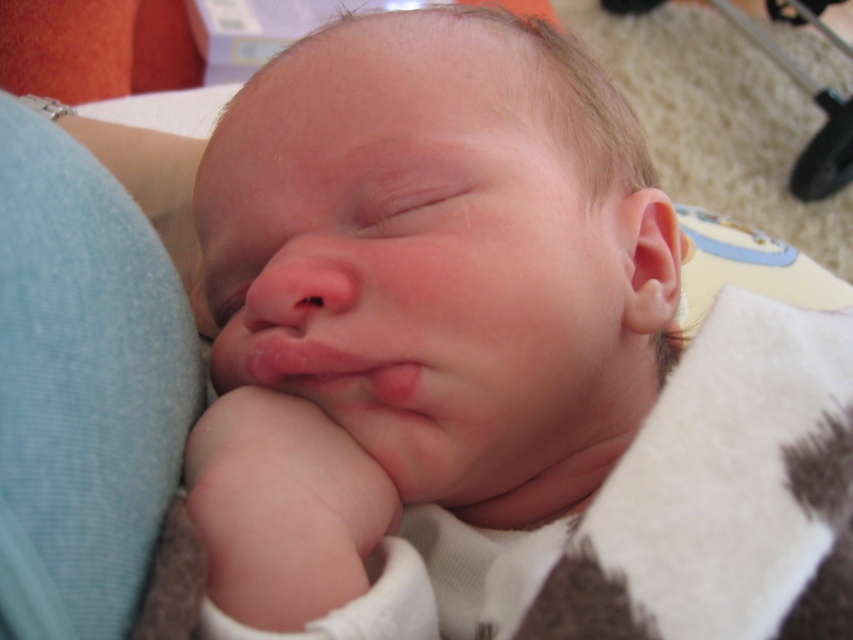
Question: Can you confirm if smooth skin newborn at center is positioned to the right of metallic silver stroller at upper right?

Choices:
 (A) yes
 (B) no

Answer: (B)

Question: Which object appears closest to the camera in this image?

Choices:
 (A) smooth skin newborn at center
 (B) metallic silver stroller at upper right

Answer: (A)

Question: From the image, what is the correct spatial relationship of smooth skin newborn at center in relation to metallic silver stroller at upper right?

Choices:
 (A) below
 (B) above

Answer: (A)

Question: Which point appears farthest from the camera in this image?

Choices:
 (A) (601, 472)
 (B) (816, 186)

Answer: (B)

Question: Is smooth skin newborn at center positioned at the back of metallic silver stroller at upper right?

Choices:
 (A) yes
 (B) no

Answer: (B)